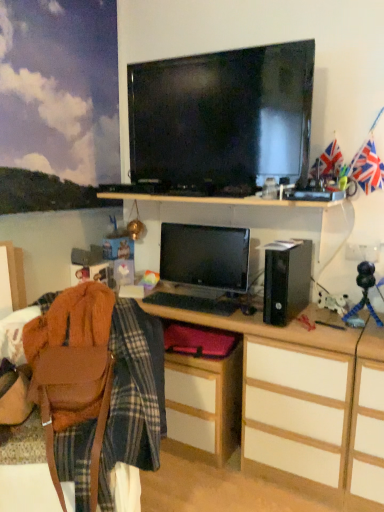
Question: From the image's perspective, is matte black television at upper center under union jack flag at upper right?

Choices:
 (A) yes
 (B) no

Answer: (B)

Question: Is matte black television at upper center directly adjacent to union jack flag at upper right?

Choices:
 (A) no
 (B) yes

Answer: (A)

Question: Does matte black television at upper center have a greater height compared to union jack flag at upper right?

Choices:
 (A) no
 (B) yes

Answer: (B)

Question: Is matte black television at upper center to the right of union jack flag at upper right from the viewer's perspective?

Choices:
 (A) yes
 (B) no

Answer: (B)

Question: Is union jack flag at upper right surrounded by matte black television at upper center?

Choices:
 (A) no
 (B) yes

Answer: (A)

Question: Is point (177, 267) positioned closer to the camera than point (76, 291)?

Choices:
 (A) closer
 (B) farther

Answer: (B)

Question: In terms of height, does satin black monitor at center look taller or shorter compared to brown leather bag at lower left?

Choices:
 (A) short
 (B) tall

Answer: (A)

Question: From a real-world perspective, is satin black monitor at center above or below brown leather bag at lower left?

Choices:
 (A) below
 (B) above

Answer: (B)

Question: Relative to brown leather bag at lower left, is satin black monitor at center in front or behind?

Choices:
 (A) behind
 (B) front

Answer: (A)

Question: From a real-world perspective, is satin black monitor at center above or below matte wood cabinet at lower center?

Choices:
 (A) below
 (B) above

Answer: (B)

Question: Considering their positions, is satin black monitor at center located in front of or behind matte wood cabinet at lower center?

Choices:
 (A) behind
 (B) front

Answer: (A)

Question: Considering the positions of satin black monitor at center and matte wood cabinet at lower center in the image, is satin black monitor at center wider or thinner than matte wood cabinet at lower center?

Choices:
 (A) wide
 (B) thin

Answer: (B)

Question: Visually, is satin black monitor at center positioned to the left or to the right of matte wood cabinet at lower center?

Choices:
 (A) right
 (B) left

Answer: (A)

Question: Is wooden desk at center in front of or behind union jack flag at upper right in the image?

Choices:
 (A) front
 (B) behind

Answer: (A)

Question: From the image's perspective, is wooden desk at center located above or below union jack flag at upper right?

Choices:
 (A) below
 (B) above

Answer: (A)